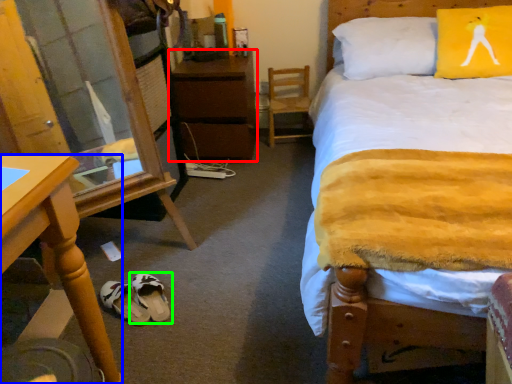
Question: Which object is positioned closest to nightstand (highlighted by a red box)? Select from desk (highlighted by a blue box) and footwear (highlighted by a green box).

Choices:
 (A) desk
 (B) footwear

Answer: (B)